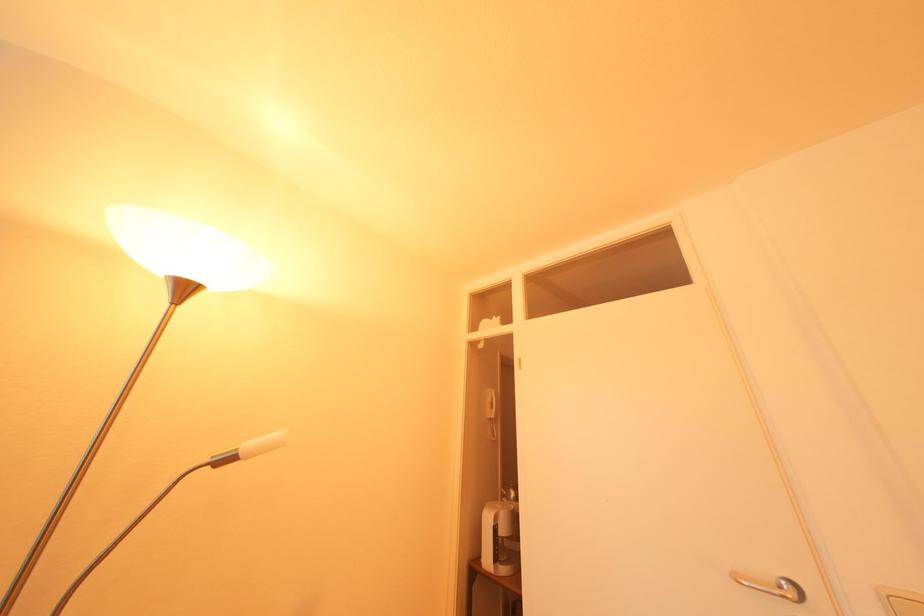
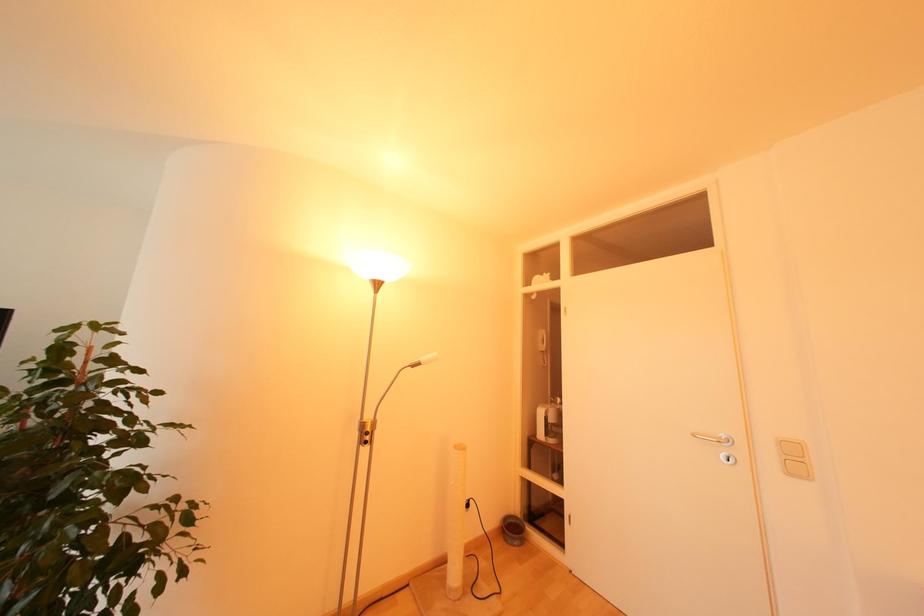
Question: The first image is from the beginning of the video and the second image is from the end. How did the camera likely rotate when shooting the video?

Choices:
 (A) Left
 (B) Right
 (C) Up
 (D) Down

Answer: (D)